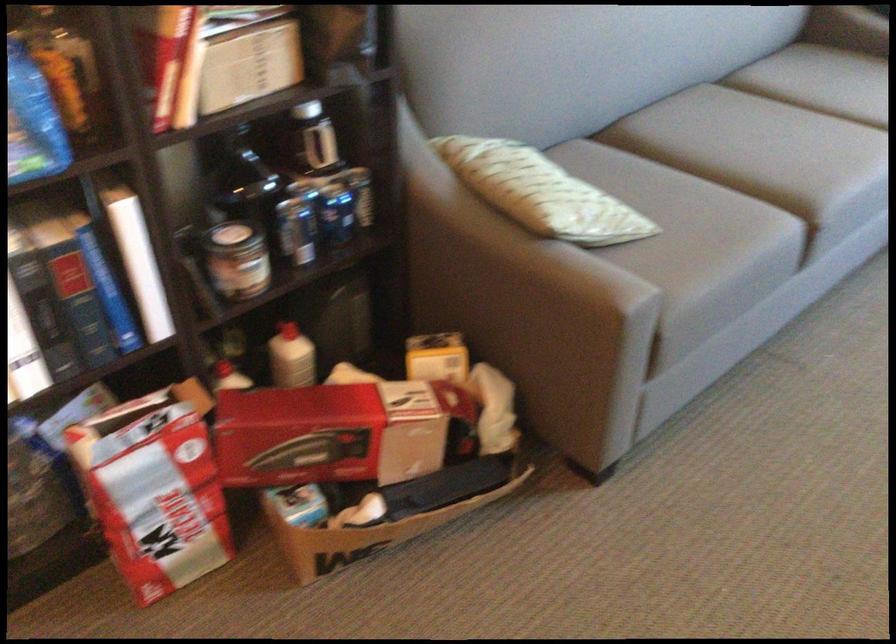
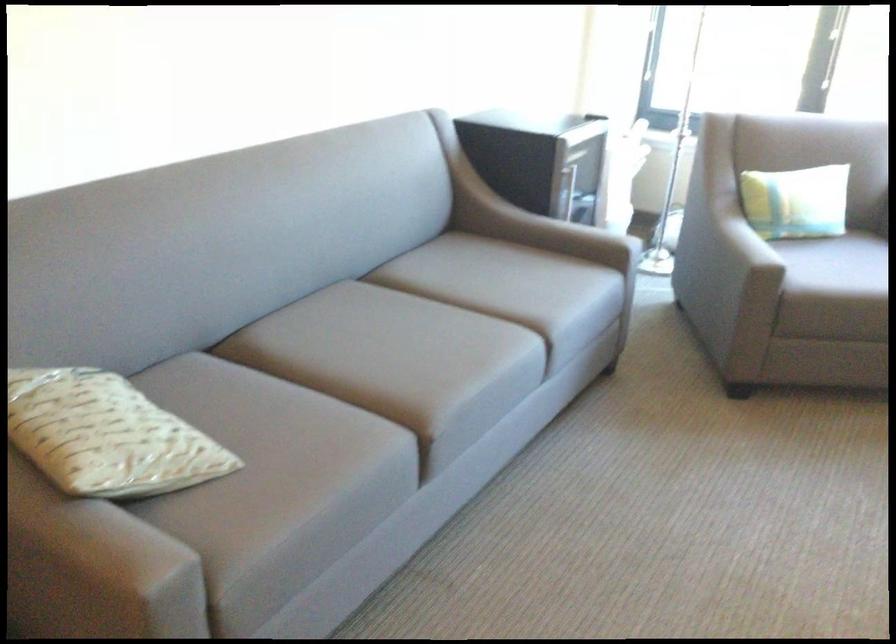
Question: The camera is either moving clockwise (left) or counter-clockwise (right) around the object. The first image is from the beginning of the video and the second image is from the end. Is the camera moving left or right when shooting the video?

Choices:
 (A) Left
 (B) Right

Answer: (A)